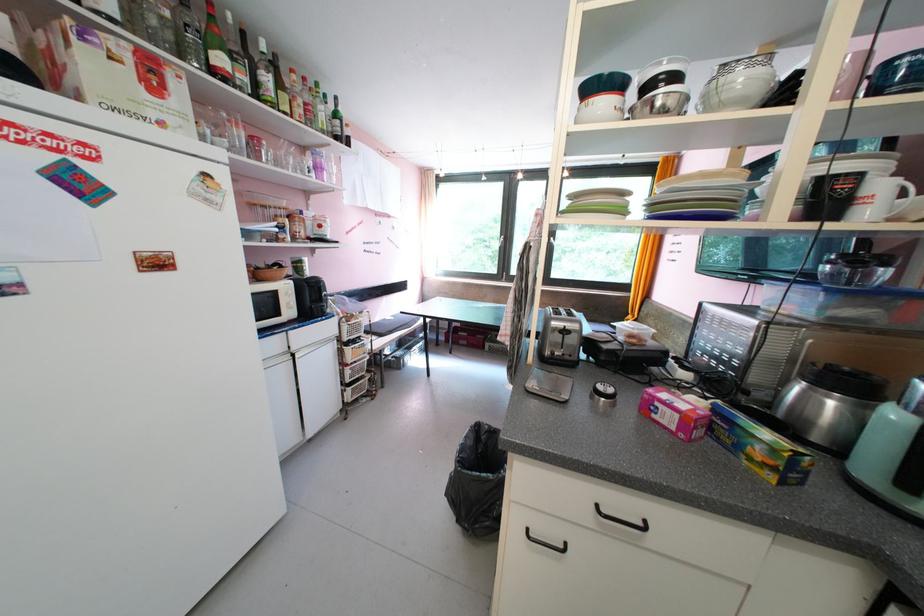
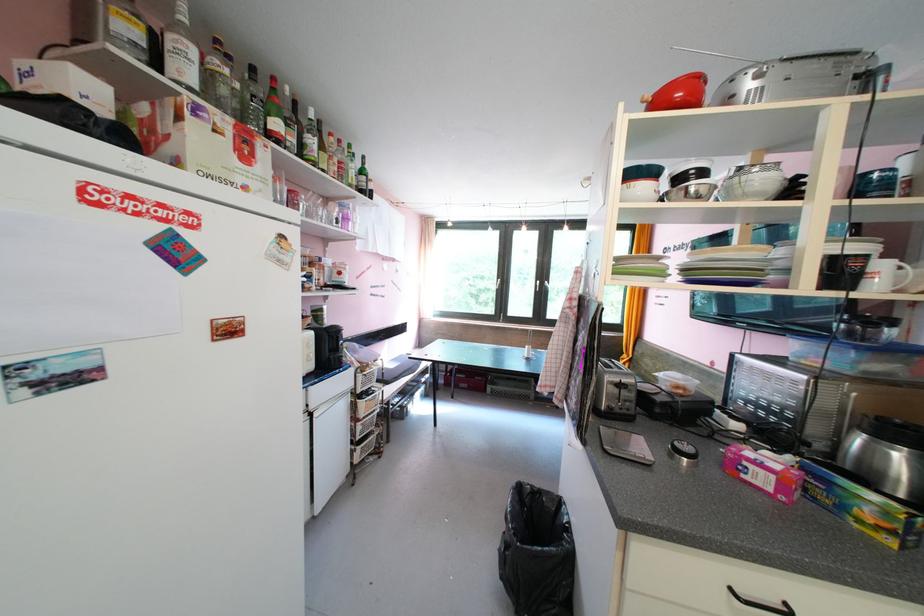
Question: The first image is from the beginning of the video and the second image is from the end. How did the camera likely rotate when shooting the video?

Choices:
 (A) Left
 (B) Right
 (C) Up
 (D) Down

Answer: (C)